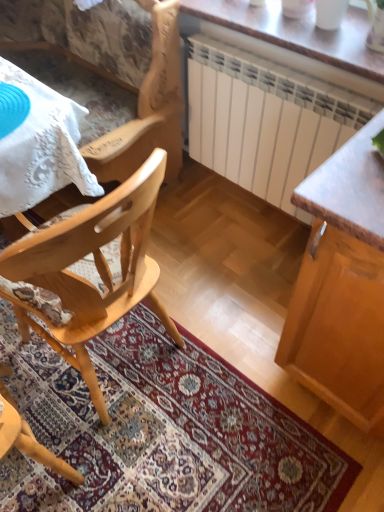
This screenshot has height=512, width=384. What do you see at coordinates (38, 142) in the screenshot?
I see `white lace tablecloth at upper left` at bounding box center [38, 142].

What do you see at coordinates (161, 430) in the screenshot? The image size is (384, 512). I see `carpeted mat at center` at bounding box center [161, 430].

Where is `white lace tablecloth at upper left`? white lace tablecloth at upper left is located at coordinates (38, 142).

Identify the location of chair lying below the wooden chair at left, which ranks as the 1th chair in top-to-bottom order (from the image's perspective). The width and height of the screenshot is (384, 512). (95, 268).

Can you confirm if wooden chair at left, which ranks as the 1th chair in top-to-bottom order, is thinner than natural wood chair at left, which is the 2th chair from top to bottom?

No.

How different are the orientations of wooden chair at left, which ranks as the 1th chair in top-to-bottom order, and natural wood chair at left, which is the 2th chair from top to bottom, in degrees?

The angular difference between wooden chair at left, which ranks as the 1th chair in top-to-bottom order, and natural wood chair at left, which is the 2th chair from top to bottom, is 85.8 degrees.

Is wooden chair at left, which ranks as the 1th chair in top-to-bottom order, inside or outside of natural wood chair at left, which is the 2th chair from top to bottom?

wooden chair at left, which ranks as the 1th chair in top-to-bottom order, is located beyond the bounds of natural wood chair at left, which is the 2th chair from top to bottom.

Does wooden table at upper center come behind white lace tablecloth at upper left?

Yes, wooden table at upper center is further from the viewer.

Based on the photo, is wooden table at upper center smaller than white lace tablecloth at upper left?

Yes, wooden table at upper center is smaller than white lace tablecloth at upper left.

From the picture: From a real-world perspective, is wooden table at upper center beneath white lace tablecloth at upper left?

No, from a real-world perspective, wooden table at upper center is not beneath white lace tablecloth at upper left.

From the image's perspective, who appears lower, wooden table at upper center or white lace tablecloth at upper left?

white lace tablecloth at upper left, from the image's perspective.

Does carpeted mat at center touch wooden table at upper center?

carpeted mat at center and wooden table at upper center are clearly separated.

Considering their positions, is carpeted mat at center located in front of or behind wooden table at upper center?

In the image, carpeted mat at center appears in front of wooden table at upper center.

Who is bigger, carpeted mat at center or wooden table at upper center?

carpeted mat at center.

This screenshot has width=384, height=512. I want to click on mat located underneath the wooden chair at left, which ranks as the 1th chair in top-to-bottom order (from a real-world perspective), so click(x=161, y=430).

Is point (270, 502) farther from viewer compared to point (172, 22)?

No, it is not.

Does carpeted mat at center appear on the left side of wooden chair at left, which ranks as the 1th chair in top-to-bottom order?

In fact, carpeted mat at center is to the right of wooden chair at left, which ranks as the 1th chair in top-to-bottom order.

From a real-world perspective, is carpeted mat at center above or below wooden chair at left, the second chair positioned from the bottom?

carpeted mat at center is below wooden chair at left, the second chair positioned from the bottom.

Is carpeted mat at center completely or partially outside of white lace tablecloth at upper left?

Yes, carpeted mat at center is not within white lace tablecloth at upper left.

Considering the sizes of objects carpeted mat at center and white lace tablecloth at upper left in the image provided, who is thinner, carpeted mat at center or white lace tablecloth at upper left?

carpeted mat at center.

Can you tell me how much carpeted mat at center and white lace tablecloth at upper left differ in facing direction?

The facing directions of carpeted mat at center and white lace tablecloth at upper left are 86.1 degrees apart.

Would you say natural wood chair at left, which is counted as the first chair, starting from the bottom, contains carpeted mat at center?

Actually, carpeted mat at center is outside natural wood chair at left, which is counted as the first chair, starting from the bottom.

From the image's perspective, is natural wood chair at left, which is counted as the first chair, starting from the bottom, below carpeted mat at center?

No.

Considering the sizes of natural wood chair at left, which is counted as the first chair, starting from the bottom, and carpeted mat at center in the image, is natural wood chair at left, which is counted as the first chair, starting from the bottom, wider or thinner than carpeted mat at center?

natural wood chair at left, which is counted as the first chair, starting from the bottom, is thinner than carpeted mat at center.

Considering the relative positions of natural wood chair at left, which is counted as the first chair, starting from the bottom, and carpeted mat at center in the image provided, is natural wood chair at left, which is counted as the first chair, starting from the bottom, behind carpeted mat at center?

No, it is in front of carpeted mat at center.

Is white lace tablecloth at upper left inside wooden cabinet at right?

Definitely not — white lace tablecloth at upper left is not inside wooden cabinet at right.

I want to click on cabinetry below the white lace tablecloth at upper left (from a real-world perspective), so click(x=342, y=285).

From a real-world perspective, is wooden cabinet at right positioned above or below white lace tablecloth at upper left?

Clearly, from a real-world perspective, wooden cabinet at right is below white lace tablecloth at upper left.

Which object is positioned more to the right, wooden cabinet at right or white lace tablecloth at upper left?

Positioned to the right is wooden cabinet at right.

Identify the location of chair behind the natural wood chair at left, which is the 2th chair from top to bottom. (147, 108).

Identify the location of desk located underneath the wooden table at upper center (from a real-world perspective). (38, 142).

Considering their positions, is wooden chair at left, the second chair positioned from the bottom, positioned further to carpeted mat at center than natural wood chair at left, which is the 2th chair from top to bottom?

wooden chair at left, the second chair positioned from the bottom, lies further to carpeted mat at center than the other object.

Estimate the real-world distances between objects in this image. Which object is closer to white lace tablecloth at upper left, wooden chair at left, the second chair positioned from the bottom, or wooden cabinet at right?

wooden chair at left, the second chair positioned from the bottom, is positioned closer to the anchor white lace tablecloth at upper left.

Looking at the image, which one is located closer to wooden chair at left, which ranks as the 1th chair in top-to-bottom order, wooden cabinet at right or carpeted mat at center?

carpeted mat at center is closer to wooden chair at left, which ranks as the 1th chair in top-to-bottom order.

In the scene shown: Based on their spatial positions, is wooden table at upper center or white lace tablecloth at upper left further from natural wood chair at left, which is the 2th chair from top to bottom?

The object further to natural wood chair at left, which is the 2th chair from top to bottom, is wooden table at upper center.

Based on their spatial positions, is wooden chair at left, the second chair positioned from the bottom, or natural wood chair at left, which is the 2th chair from top to bottom, closer to wooden cabinet at right?

natural wood chair at left, which is the 2th chair from top to bottom.

Based on their spatial positions, is wooden cabinet at right or carpeted mat at center further from wooden table at upper center?

The object further to wooden table at upper center is carpeted mat at center.

Looking at the image, which one is located closer to white lace tablecloth at upper left, natural wood chair at left, which is counted as the first chair, starting from the bottom, or wooden table at upper center?

The object closer to white lace tablecloth at upper left is natural wood chair at left, which is counted as the first chair, starting from the bottom.

From the image, which object appears to be farther from wooden table at upper center, white lace tablecloth at upper left or carpeted mat at center?

Among the two, carpeted mat at center is located further to wooden table at upper center.

You are a GUI agent. You are given a task and a screenshot of the screen. Output one action in this format:
    pyautogui.click(x=<x>, y=<y>)
    Task: Click on the table between white lace tablecloth at upper left and wooden cabinet at right from left to right
    The image size is (384, 512).
    Given the screenshot: What is the action you would take?
    pyautogui.click(x=297, y=33)

At what (x,y) coordinates should I click in order to perform the action: click on desk between wooden table at upper center and carpeted mat at center in the up-down direction. Please return your answer as a coordinate pair (x, y). The width and height of the screenshot is (384, 512). Looking at the image, I should click on (38, 142).

In order to click on chair that lies between wooden table at upper center and natural wood chair at left, which is counted as the first chair, starting from the bottom, from top to bottom in this screenshot , I will do `click(147, 108)`.

Find the location of `mat situated between white lace tablecloth at upper left and wooden cabinet at right from left to right`. mat situated between white lace tablecloth at upper left and wooden cabinet at right from left to right is located at coordinates (161, 430).